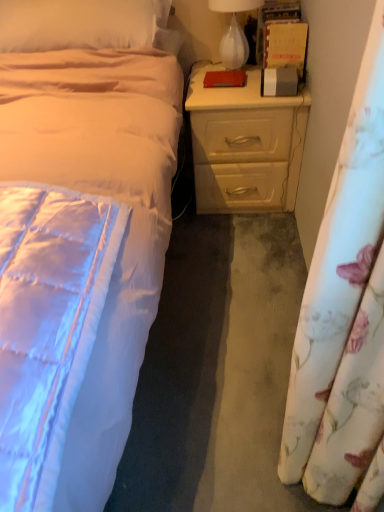
Question: Is floral fabric curtain at right situated inside white glass lamp at upper right or outside?

Choices:
 (A) outside
 (B) inside

Answer: (A)

Question: From a real-world perspective, is floral fabric curtain at right above or below white glass lamp at upper right?

Choices:
 (A) above
 (B) below

Answer: (B)

Question: Which object is positioned closest to the floral fabric curtain at right?

Choices:
 (A) white glass lamp at upper right
 (B) beige wood nightstand at right
 (C) beige satin pillow at upper left

Answer: (B)

Question: Based on their relative distances, which object is farther from the beige satin pillow at upper left?

Choices:
 (A) floral fabric curtain at right
 (B) beige wood nightstand at right
 (C) white glass lamp at upper right

Answer: (A)